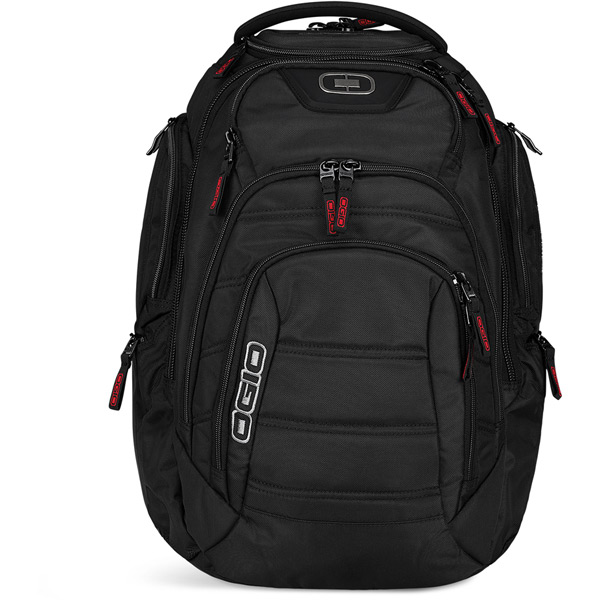
The width and height of the screenshot is (600, 600). Identify the location of upper left compartment. (173, 202).